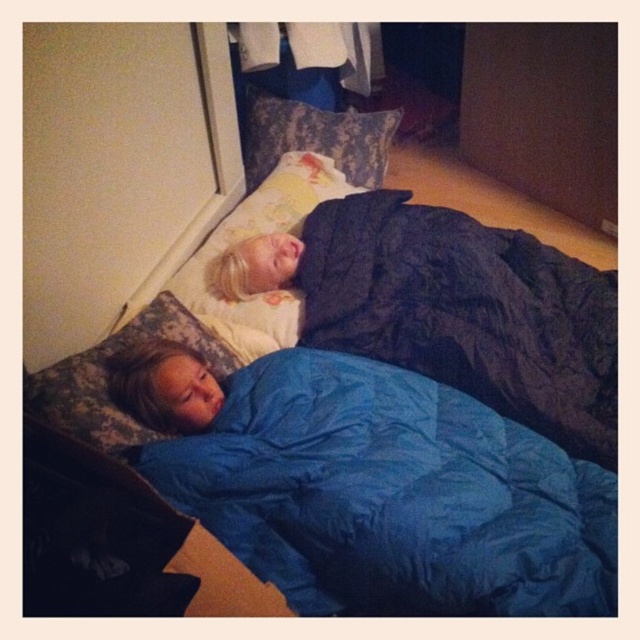
Question: Among these objects, which one is farthest from the camera?

Choices:
 (A) blue synthetic sleeping bag at lower left
 (B) camouflage fabric pillow at lower left
 (C) blue down-filled sleeping bag at upper center
 (D) patterned fabric pillow at upper center

Answer: (D)

Question: Is blue down-filled sleeping bag at upper center bigger than yellow floral pillow at upper center?

Choices:
 (A) yes
 (B) no

Answer: (A)

Question: Can you confirm if blue down-filled sleeping bag at upper center is positioned below yellow floral pillow at upper center?

Choices:
 (A) no
 (B) yes

Answer: (B)

Question: Among these points, which one is nearest to the camera?

Choices:
 (A) (x=193, y=294)
 (B) (x=560, y=480)

Answer: (B)

Question: Can you confirm if yellow floral pillow at upper center is thinner than camouflage fabric pillow at lower left?

Choices:
 (A) yes
 (B) no

Answer: (B)

Question: Which of these objects is positioned closest to the camouflage fabric pillow at lower left?

Choices:
 (A) blue down-filled sleeping bag at upper center
 (B) patterned fabric pillow at upper center
 (C) blue synthetic sleeping bag at lower left
 (D) yellow floral pillow at upper center

Answer: (C)